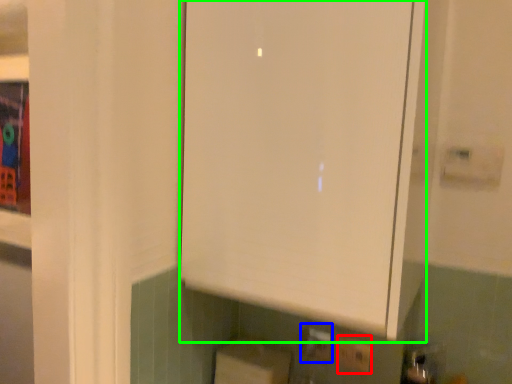
Question: Which object is the closest to the electric outlet (highlighted by a red box)? Choose among these: electric outlet (highlighted by a blue box) or cabinetry (highlighted by a green box).

Choices:
 (A) electric outlet
 (B) cabinetry

Answer: (A)